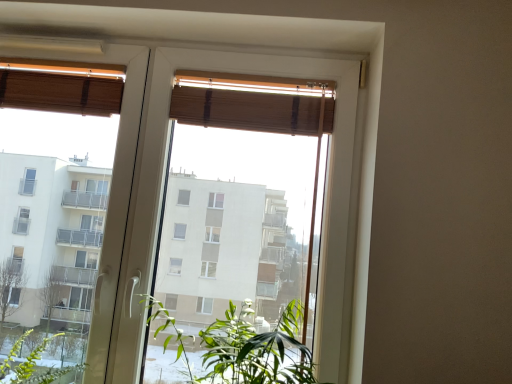
Question: Is wooden blinds at upper center positioned in front of wooden blind at upper center, which is the 2th curtain in left-to-right order?

Choices:
 (A) no
 (B) yes

Answer: (B)

Question: From a real-world perspective, is wooden blinds at upper center on wooden blind at upper center, which is the 2th curtain in left-to-right order?

Choices:
 (A) no
 (B) yes

Answer: (A)

Question: Is wooden blinds at upper center looking in the opposite direction of wooden blind at upper center, which is the 2th curtain in left-to-right order?

Choices:
 (A) yes
 (B) no

Answer: (A)

Question: Is wooden blinds at upper center not within wooden blind at upper center, which is the 1th curtain from right to left?

Choices:
 (A) yes
 (B) no

Answer: (A)

Question: Considering the relative sizes of wooden blinds at upper center and wooden blind at upper center, which is the 1th curtain from right to left, in the image provided, is wooden blinds at upper center bigger than wooden blind at upper center, which is the 1th curtain from right to left,?

Choices:
 (A) no
 (B) yes

Answer: (B)

Question: Is wooden blinds at upper center taller or shorter than wooden blind at upper center, which is the 2th curtain in left-to-right order?

Choices:
 (A) tall
 (B) short

Answer: (A)

Question: In terms of width, does wooden blinds at upper center look wider or thinner when compared to wooden blind at upper center, which is the 1th curtain from right to left?

Choices:
 (A) thin
 (B) wide

Answer: (B)

Question: From a real-world perspective, is wooden blinds at upper center above or below wooden blind at upper center, which is the 1th curtain from right to left?

Choices:
 (A) below
 (B) above

Answer: (A)

Question: In the image, is wooden blinds at upper center on the left side or the right side of wooden blind at upper center, which is the 1th curtain from right to left?

Choices:
 (A) right
 (B) left

Answer: (B)

Question: Considering their positions, is wooden blind at upper left, arranged as the 1th curtain when viewed from the left, located in front of or behind green leafy plant at center?

Choices:
 (A) behind
 (B) front

Answer: (A)

Question: Is wooden blind at upper left, which ranks as the 2th curtain in right-to-left order, taller or shorter than green leafy plant at center?

Choices:
 (A) tall
 (B) short

Answer: (B)

Question: Is point (97, 100) positioned closer to the camera than point (253, 332)?

Choices:
 (A) farther
 (B) closer

Answer: (A)

Question: From the image's perspective, is wooden blind at upper left, which ranks as the 2th curtain in right-to-left order, above or below green leafy plant at center?

Choices:
 (A) above
 (B) below

Answer: (A)

Question: Is wooden blind at upper center, which is the 2th curtain in left-to-right order, taller or shorter than wooden blinds at upper center?

Choices:
 (A) tall
 (B) short

Answer: (B)

Question: From the image's perspective, is wooden blind at upper center, which is the 2th curtain in left-to-right order, positioned above or below wooden blinds at upper center?

Choices:
 (A) below
 (B) above

Answer: (B)